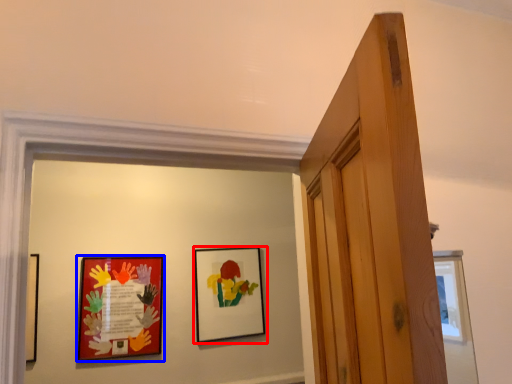
Question: Which object appears closest to the camera in this image, picture frame (highlighted by a red box) or picture frame (highlighted by a blue box)?

Choices:
 (A) picture frame
 (B) picture frame

Answer: (B)